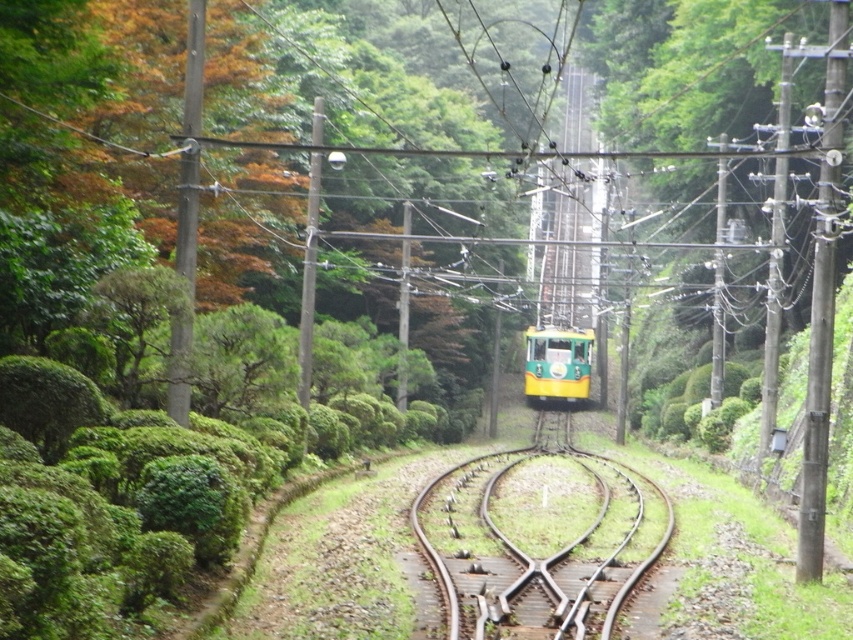
Question: Which of the following is the closest to the observer?

Choices:
 (A) brown wooden train track at center
 (B) green matte train at center

Answer: (A)

Question: Is brown wooden train track at center to the left of green matte train at center from the viewer's perspective?

Choices:
 (A) yes
 (B) no

Answer: (A)

Question: In this image, where is brown wooden train track at center located relative to green matte train at center?

Choices:
 (A) left
 (B) right

Answer: (A)

Question: Among these objects, which one is nearest to the camera?

Choices:
 (A) green matte train at center
 (B) brown wooden train track at center

Answer: (B)

Question: Observing the image, what is the correct spatial positioning of brown wooden train track at center in reference to green matte train at center?

Choices:
 (A) right
 (B) left

Answer: (B)